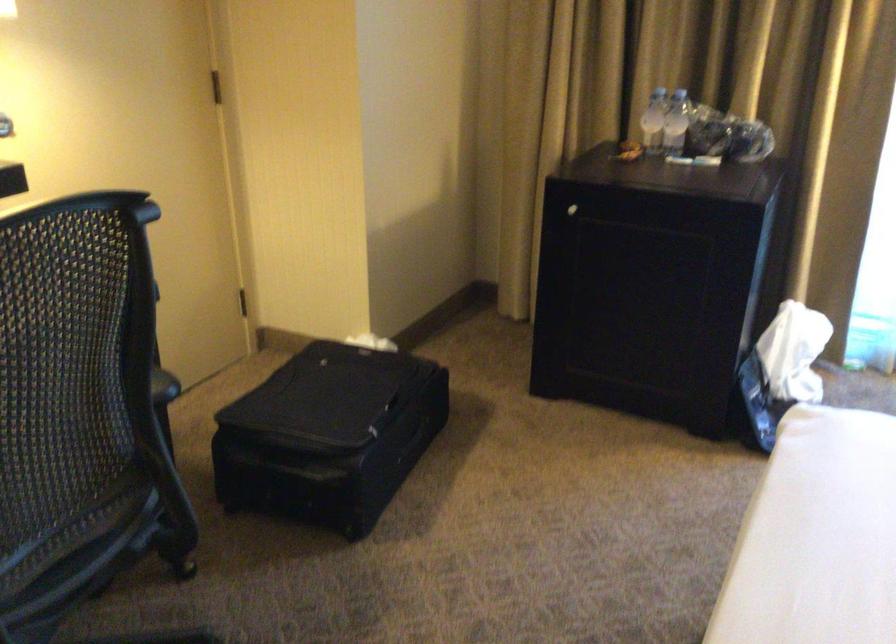
The location [653,120] corresponds to which object?

It refers to a clear water bottle.